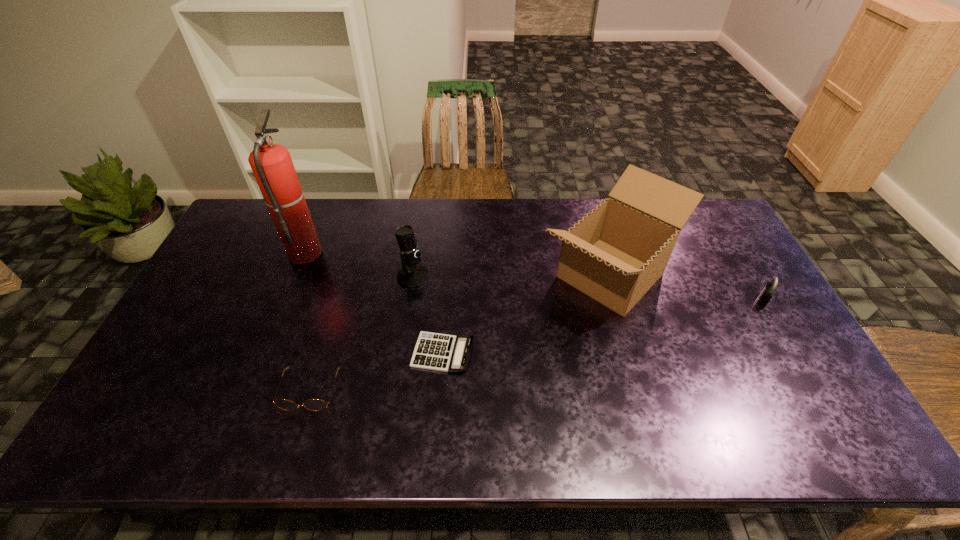
Where is `fire extinguisher`? This screenshot has height=540, width=960. fire extinguisher is located at coordinates tap(272, 166).

The height and width of the screenshot is (540, 960). I want to click on the tallest object, so click(272, 166).

At what (x,y) coordinates should I click in order to perform the action: click on box. Please return your answer as a coordinate pair (x, y). Looking at the image, I should click on (614, 254).

You are a GUI agent. You are given a task and a screenshot of the screen. Output one action in this format:
    pyautogui.click(x=<x>, y=<y>)
    Task: Click on the fifth object from left to right
    This screenshot has height=540, width=960.
    Given the screenshot: What is the action you would take?
    pyautogui.click(x=614, y=254)

Find the location of a particular element. the fourth shortest object is located at coordinates (412, 275).

The height and width of the screenshot is (540, 960). I want to click on padlock, so click(x=766, y=294).

Locate an element on the screen. This screenshot has height=540, width=960. the rightmost object is located at coordinates [766, 294].

This screenshot has height=540, width=960. I want to click on the second shortest object, so click(311, 404).

Find the location of a particular element. the second object from left to right is located at coordinates (311, 404).

I want to click on calculator, so click(x=433, y=351).